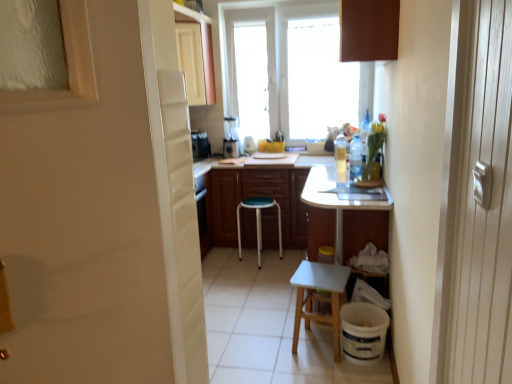
Question: Would you say clear plastic bottle at right, the 2th bottle from the right, is inside or outside white glossy screen door at left?

Choices:
 (A) inside
 (B) outside

Answer: (B)

Question: From the image's perspective, is clear plastic bottle at right, the 3th bottle viewed from the back, located above or below white glossy screen door at left?

Choices:
 (A) below
 (B) above

Answer: (B)

Question: Considering the real-world distances, which object is closest to the translucent plastic bottle at upper right, the 2th bottle when ordered from front to back?

Choices:
 (A) brown matte cabinet at center, which appears as the 1th cabinetry when ordered from the bottom
 (B) matte white cabinet at upper center, acting as the 2th cabinetry starting from the back
 (C) transparent plastic bottle at upper right, which ranks as the 3th bottle in front-to-back order
 (D) white glossy screen door at left
 (E) green plastic stool at center, the 2th stool in the right-to-left sequence

Answer: (C)

Question: Which is farther from the brown matte cabinet at center, which appears as the 1th cabinetry when ordered from the bottom?

Choices:
 (A) green plastic stool at center, the 2th stool in the right-to-left sequence
 (B) brown matte cabinet at upper center, the 1th cabinetry in the right-to-left sequence
 (C) translucent plastic bottle at upper right, marked as the 1th bottle in a left-to-right arrangement
 (D) metallic silver blender at center
 (E) white wood stool at lower center, the 2th stool when ordered from back to front

Answer: (B)